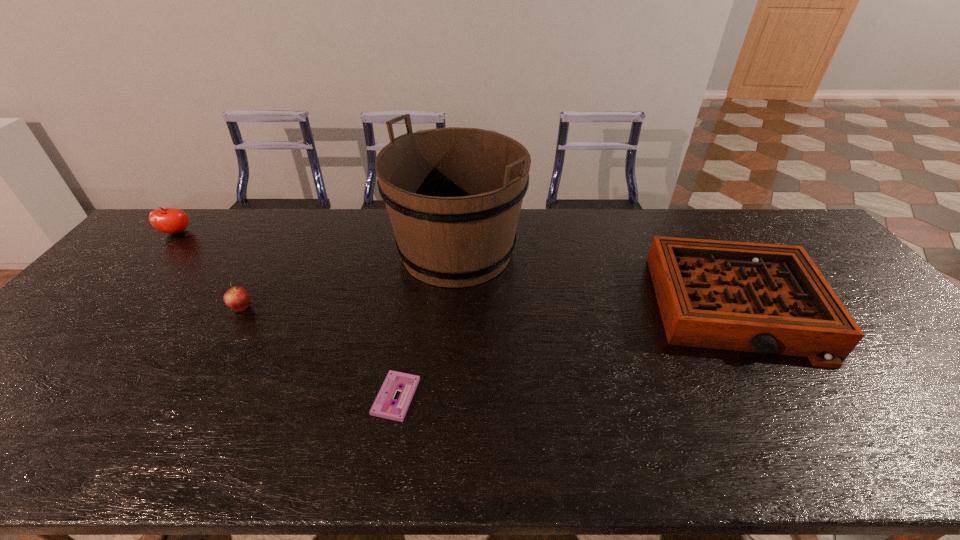
This screenshot has width=960, height=540. In order to click on the fourth closest object to the gameboard in this screenshot , I will do `click(167, 220)`.

Image resolution: width=960 pixels, height=540 pixels. I want to click on free point that satisfies the following two spatial constraints: 1. on the front side of the shortest object; 2. on the left side of the leftmost object, so (x=30, y=397).

Where is `free point that satisfies the following two spatial constraints: 1. on the front side of the farther apple; 2. on the left side of the bucket`? This screenshot has width=960, height=540. free point that satisfies the following two spatial constraints: 1. on the front side of the farther apple; 2. on the left side of the bucket is located at coordinates (158, 252).

The image size is (960, 540). I want to click on free space that satisfies the following two spatial constraints: 1. on the front side of the rightmost object; 2. on the left side of the leftmost object, so click(x=109, y=307).

Image resolution: width=960 pixels, height=540 pixels. Identify the location of vacant space that satisfies the following two spatial constraints: 1. on the front side of the bucket; 2. on the right side of the rightmost object. (453, 307).

Where is `free space that satisfies the following two spatial constraints: 1. on the back side of the bucket; 2. on the right side of the videotape`? The width and height of the screenshot is (960, 540). free space that satisfies the following two spatial constraints: 1. on the back side of the bucket; 2. on the right side of the videotape is located at coordinates (420, 252).

Identify the location of free space that satisfies the following two spatial constraints: 1. on the front side of the gameboard; 2. on the right side of the bucket. (453, 307).